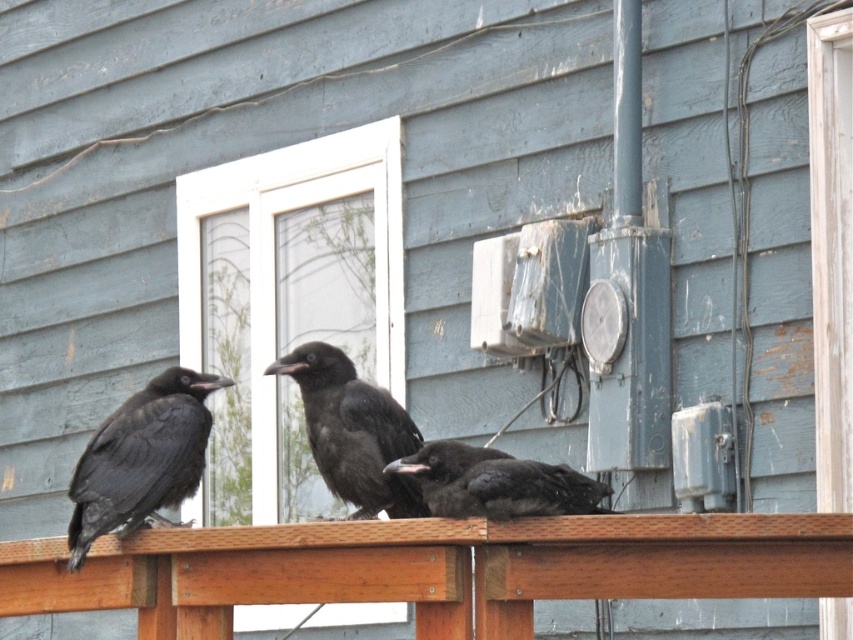
Can you confirm if shiny black raven at left is positioned to the left of shiny black raven at center?

Correct, you'll find shiny black raven at left to the left of shiny black raven at center.

Can you confirm if shiny black raven at left is wider than shiny black raven at center?

No.

The width and height of the screenshot is (853, 640). Describe the element at coordinates (141, 458) in the screenshot. I see `shiny black raven at left` at that location.

Find the location of `shiny black raven at left`. shiny black raven at left is located at coordinates (141, 458).

Is shiny black raven at left further to the viewer compared to black matte bird at center?

Yes, it is behind black matte bird at center.

Is point (71, 481) positioned behind point (599, 497)?

Yes.

Find the location of a particular element. This screenshot has width=853, height=640. shiny black raven at left is located at coordinates (141, 458).

Is brown wood rail at center to the right of shiny black raven at center from the viewer's perspective?

Correct, you'll find brown wood rail at center to the right of shiny black raven at center.

Between brown wood rail at center and shiny black raven at center, which one is positioned higher?

shiny black raven at center is above.

Describe the element at coordinates (432, 568) in the screenshot. Image resolution: width=853 pixels, height=640 pixels. I see `brown wood rail at center` at that location.

The width and height of the screenshot is (853, 640). What are the coordinates of `brown wood rail at center` in the screenshot? It's located at (432, 568).